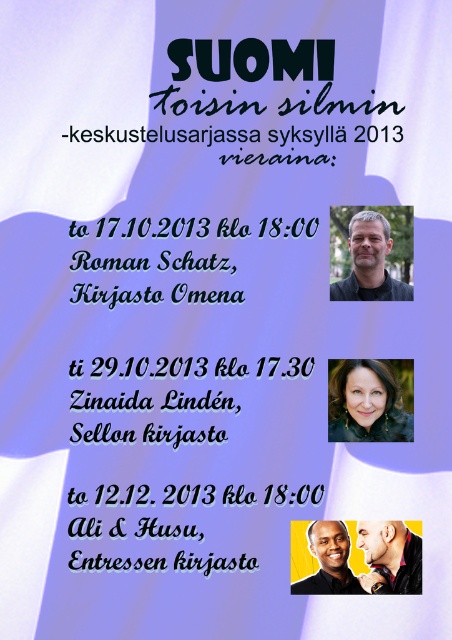
Is smooth black hair at center bigger than smooth black face at upper center?

Actually, smooth black hair at center might be smaller than smooth black face at upper center.

Between smooth black hair at center and smooth black face at upper center, which one is positioned higher?

smooth black hair at center is above.

Who is more forward, (340, 406) or (321, 561)?

Positioned in front is point (321, 561).

You are a GUI agent. You are given a task and a screenshot of the screen. Output one action in this format:
    pyautogui.click(x=<x>, y=<y>)
    Task: Click on the smooth black hair at center
    
    Given the screenshot: What is the action you would take?
    pyautogui.click(x=367, y=403)

Between point (208, 268) and point (390, 440), which one is positioned behind?

Positioned behind is point (390, 440).

Who is more forward, (135, 269) or (373, 374)?

Point (135, 269)

This screenshot has height=640, width=452. Identify the location of black paper text at upper center. (154, 227).

Who is shorter, smooth black hair at center or smooth skin face at center?

smooth skin face at center

Which is in front, point (363, 408) or point (390, 524)?

Point (390, 524)

Between point (404, 435) and point (384, 568), which one is positioned behind?

Positioned behind is point (404, 435).

Find the location of a particular element. Image resolution: width=452 pixels, height=640 pixels. smooth black hair at center is located at coordinates (367, 403).